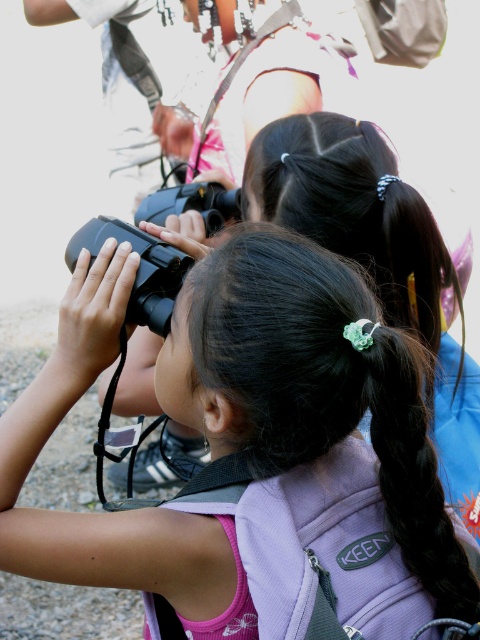
Is black matte binoculars at center positioned at the back of black silky hair at center?

No, black matte binoculars at center is closer to the viewer.

Is black matte binoculars at center wider than black silky hair at center?

Correct, the width of black matte binoculars at center exceeds that of black silky hair at center.

What do you see at coordinates (254, 456) in the screenshot? The width and height of the screenshot is (480, 640). I see `black matte binoculars at center` at bounding box center [254, 456].

Identify the location of black matte binoculars at center. The height and width of the screenshot is (640, 480). (254, 456).